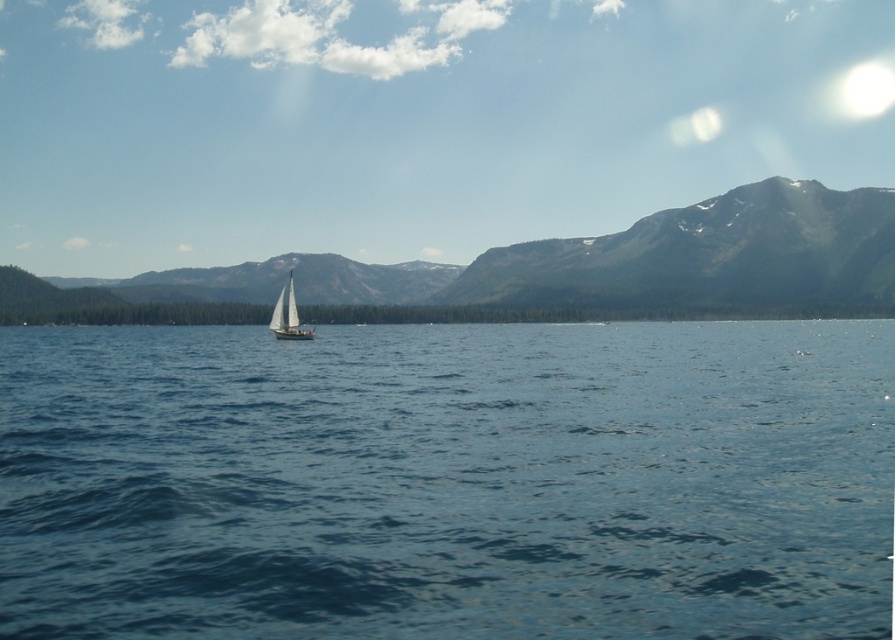
You are planning a photography session and want to capture both the green textured mountain at center and the white matte sailboat at center in a single frame. Given that your camera has a 50mm lens, which has a standard field of view, can you fit both objects into the frame without moving the camera? Consider their distance apart.

The distance between the green textured mountain at center and the white matte sailboat at center is 964.90 feet. With a 50mm lens having a standard field of view, it is unlikely to capture both objects in a single frame without moving the camera due to the significant distance between them.

You are standing at the lakeside and want to take a photo of the blue smooth water at center and the green textured mountain at center. Which object will appear larger in your photo?

The blue smooth water at center will appear larger in the photo because it is closer to the viewer than the green textured mountain at center.